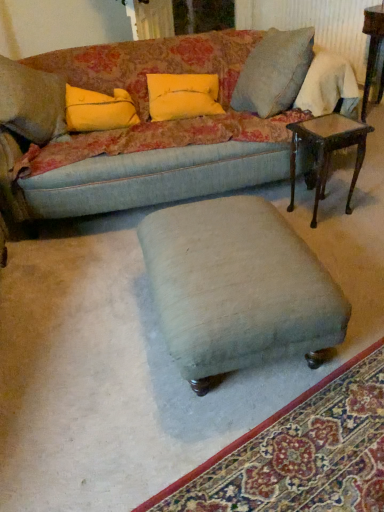
Question: From a real-world perspective, is yellow fabric pillow at upper left, the 2th pillow from the right, located higher than velvet green ottoman at center?

Choices:
 (A) no
 (B) yes

Answer: (B)

Question: Does yellow fabric pillow at upper left, which ranks as the first pillow in left-to-right order, have a greater width compared to velvet green ottoman at center?

Choices:
 (A) no
 (B) yes

Answer: (A)

Question: Is yellow fabric pillow at upper left, which ranks as the first pillow in left-to-right order, looking in the opposite direction of velvet green ottoman at center?

Choices:
 (A) no
 (B) yes

Answer: (A)

Question: Does yellow fabric pillow at upper left, the 2th pillow from the right, have a greater height compared to velvet green ottoman at center?

Choices:
 (A) no
 (B) yes

Answer: (B)

Question: From the image's perspective, would you say yellow fabric pillow at upper left, the 2th pillow from the right, is positioned over velvet green ottoman at center?

Choices:
 (A) no
 (B) yes

Answer: (B)

Question: Considering the relative sizes of wooden side table at upper right, acting as the first table starting from the top, and yellow fabric pillow at upper center, arranged as the 2th pillow when viewed from the left, in the image provided, is wooden side table at upper right, acting as the first table starting from the top, smaller than yellow fabric pillow at upper center, arranged as the 2th pillow when viewed from the left,?

Choices:
 (A) yes
 (B) no

Answer: (B)

Question: Is wooden side table at upper right, which is the second table in left-to-right order, at the left side of yellow fabric pillow at upper center, arranged as the 2th pillow when viewed from the left?

Choices:
 (A) no
 (B) yes

Answer: (A)

Question: Is wooden side table at upper right, the 2th table from the front, taller than yellow fabric pillow at upper center, the first pillow when ordered from right to left?

Choices:
 (A) no
 (B) yes

Answer: (B)

Question: From the image's perspective, would you say wooden side table at upper right, the 2th table ordered from the bottom, is shown under yellow fabric pillow at upper center, the first pillow when ordered from right to left?

Choices:
 (A) yes
 (B) no

Answer: (B)

Question: Is wooden side table at upper right, the 2th table from the front, next to yellow fabric pillow at upper center, arranged as the 2th pillow when viewed from the left, and touching it?

Choices:
 (A) no
 (B) yes

Answer: (A)

Question: Can you confirm if wooden side table at upper right, the 2th table from the front, is positioned to the right of yellow fabric pillow at upper center, arranged as the 2th pillow when viewed from the left?

Choices:
 (A) yes
 (B) no

Answer: (A)

Question: Is there a large distance between velvet green ottoman at center and velvet green ottoman at center?

Choices:
 (A) no
 (B) yes

Answer: (A)